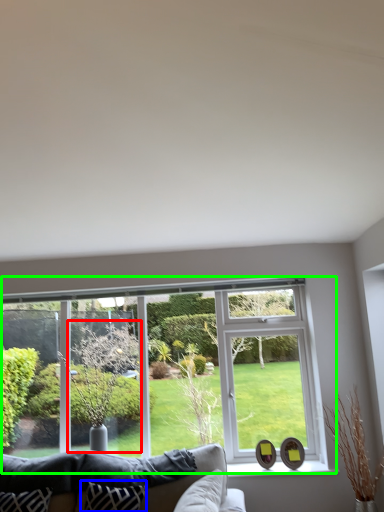
Question: Which is farther away from tree (highlighted by a red box)? pillow (highlighted by a blue box) or window (highlighted by a green box)?

Choices:
 (A) pillow
 (B) window

Answer: (A)